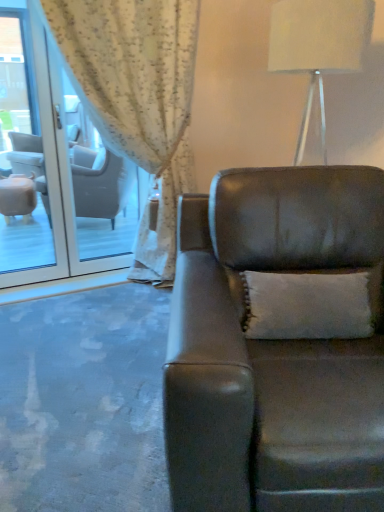
This screenshot has width=384, height=512. In order to click on white textured pillow at center in this screenshot , I will do `click(311, 304)`.

Locate an element on the screen. white textured curtain at upper left is located at coordinates (137, 98).

You are a GUI agent. You are given a task and a screenshot of the screen. Output one action in this format:
    pyautogui.click(x=<x>, y=<y>)
    Task: Click on the white fabric lampshade at upper right
    The width and height of the screenshot is (384, 512).
    Given the screenshot: What is the action you would take?
    pyautogui.click(x=318, y=47)

Is white fabric lampshade at upper right bigger or smaller than leather couch at center?

Considering their sizes, white fabric lampshade at upper right takes up less space than leather couch at center.

From the image's perspective, is white fabric lampshade at upper right located above or below leather couch at center?

white fabric lampshade at upper right is situated higher than leather couch at center in the image.

From a real-world perspective, relative to leather couch at center, is white fabric lampshade at upper right vertically above or below?

In terms of real-world spatial position, white fabric lampshade at upper right is above leather couch at center.

In terms of width, does white fabric lampshade at upper right look wider or thinner when compared to leather couch at center?

Considering their sizes, white fabric lampshade at upper right looks slimmer than leather couch at center.

Considering the relative sizes of clear glass door at left and white fabric lampshade at upper right in the image provided, is clear glass door at left bigger than white fabric lampshade at upper right?

Incorrect, clear glass door at left is not larger than white fabric lampshade at upper right.

Between clear glass door at left and white fabric lampshade at upper right, which one has larger width?

white fabric lampshade at upper right is wider.

Is point (48, 125) positioned in front of point (308, 112)?

Yes, point (48, 125) is in front of point (308, 112).

From a real-world perspective, between leather couch at center and white fabric lampshade at upper right, who is vertically lower?

leather couch at center.

From the image's perspective, is leather couch at center above or below white fabric lampshade at upper right?

Clearly, from the image's perspective, leather couch at center is below white fabric lampshade at upper right.

Between leather couch at center and white fabric lampshade at upper right, which one is positioned in front?

Positioned in front is leather couch at center.

Which is more distant, (x=311, y=222) or (x=275, y=12)?

The point (x=275, y=12) is farther.

Considering the relative positions of white textured curtain at upper left and leather couch at center in the image provided, is white textured curtain at upper left to the left or to the right of leather couch at center?

white textured curtain at upper left is positioned on leather couch at center's left side.

Who is smaller, white textured curtain at upper left or leather couch at center?

With smaller size is white textured curtain at upper left.

Considering the relative sizes of white textured curtain at upper left and leather couch at center in the image provided, is white textured curtain at upper left wider than leather couch at center?

No, white textured curtain at upper left is not wider than leather couch at center.

From the picture: Is white textured curtain at upper left not inside leather couch at center?

white textured curtain at upper left is positioned outside leather couch at center.

Considering the positions of objects white textured pillow at center and leather couch at center in the image provided, who is more to the right, white textured pillow at center or leather couch at center?

leather couch at center is more to the right.

Is leather couch at center at the back of white textured pillow at center?

That's right, white textured pillow at center is facing away from leather couch at center.

Can you confirm if white textured pillow at center is bigger than leather couch at center?

Incorrect, white textured pillow at center is not larger than leather couch at center.

Is point (326, 41) in front of point (323, 287)?

No.

Identify the location of pillow in front of the white fabric lampshade at upper right. pyautogui.click(x=311, y=304).

Is white fabric lampshade at upper right aimed at white textured pillow at center?

No, white fabric lampshade at upper right is not aimed at white textured pillow at center.

Is white fabric lampshade at upper right touching white textured pillow at center?

No, white fabric lampshade at upper right is not touching white textured pillow at center.

Locate an element on the screen. This screenshot has width=384, height=512. table lamp on the right of clear glass door at left is located at coordinates (318, 47).

Is white fabric lampshade at upper right outside of clear glass door at left?

Yes, white fabric lampshade at upper right is not within clear glass door at left.

From the image's perspective, is white fabric lampshade at upper right above or below clear glass door at left?

white fabric lampshade at upper right is above clear glass door at left.

This screenshot has width=384, height=512. Identify the location of table lamp on the right of leather couch at center. tap(318, 47).

Where is `table lamp above the clear glass door at left (from a real-world perspective)`? The width and height of the screenshot is (384, 512). table lamp above the clear glass door at left (from a real-world perspective) is located at coordinates coord(318,47).

Which object lies nearer to the anchor point white fabric lampshade at upper right, white textured curtain at upper left or clear glass door at left?

The object closer to white fabric lampshade at upper right is white textured curtain at upper left.

Which object lies nearer to the anchor point leather couch at center, white textured curtain at upper left or white fabric lampshade at upper right?

white fabric lampshade at upper right is closer to leather couch at center.

Looking at the image, which one is located further to white textured pillow at center, clear glass door at left or leather couch at center?

The object further to white textured pillow at center is clear glass door at left.

When comparing their distances from white fabric lampshade at upper right, does clear glass door at left or leather couch at center seem closer?

leather couch at center.

Based on the photo, considering their positions, is white fabric lampshade at upper right positioned closer to leather couch at center than white textured pillow at center?

white textured pillow at center lies closer to leather couch at center than the other object.

Estimate the real-world distances between objects in this image. Which object is closer to white textured pillow at center, leather couch at center or white textured curtain at upper left?

leather couch at center lies closer to white textured pillow at center than the other object.

From the picture: Looking at the image, which one is located further to leather couch at center, white fabric lampshade at upper right or white textured curtain at upper left?

Among the two, white textured curtain at upper left is located further to leather couch at center.

Looking at the image, which one is located further to clear glass door at left, white textured pillow at center or white fabric lampshade at upper right?

The object further to clear glass door at left is white textured pillow at center.

Locate an element on the screen. The width and height of the screenshot is (384, 512). pillow that lies between white fabric lampshade at upper right and leather couch at center from top to bottom is located at coordinates (311, 304).

Locate an element on the screen. The image size is (384, 512). curtain located between clear glass door at left and leather couch at center in the left-right direction is located at coordinates (137, 98).

Identify the location of curtain located between clear glass door at left and white textured pillow at center in the left-right direction. (137, 98).

Where is `curtain between white fabric lampshade at upper right and leather couch at center in the up-down direction`? curtain between white fabric lampshade at upper right and leather couch at center in the up-down direction is located at coordinates (137, 98).